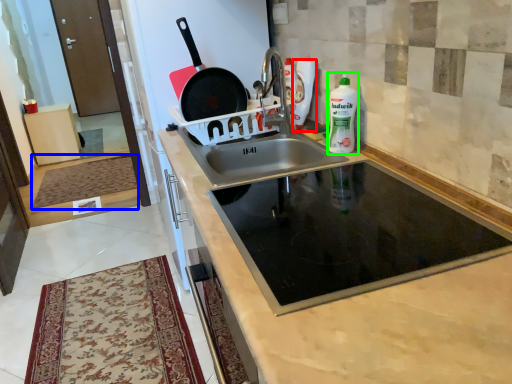
Question: Which object is the closest to the cleaning product (highlighted by a red box)? Choose among these: mat (highlighted by a blue box) or bottle (highlighted by a green box).

Choices:
 (A) mat
 (B) bottle

Answer: (B)